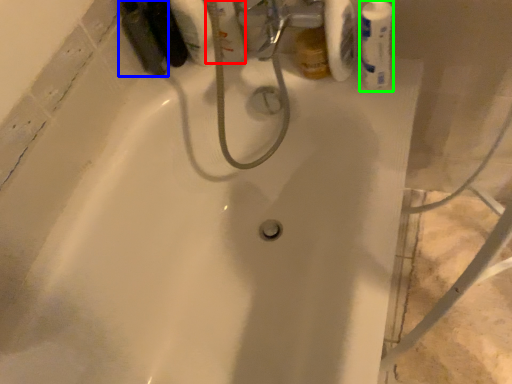
Question: Which object is the closest to the mouthwash (highlighted by a red box)? Choose among these: mouthwash (highlighted by a blue box) or mouthwash (highlighted by a green box).

Choices:
 (A) mouthwash
 (B) mouthwash

Answer: (A)